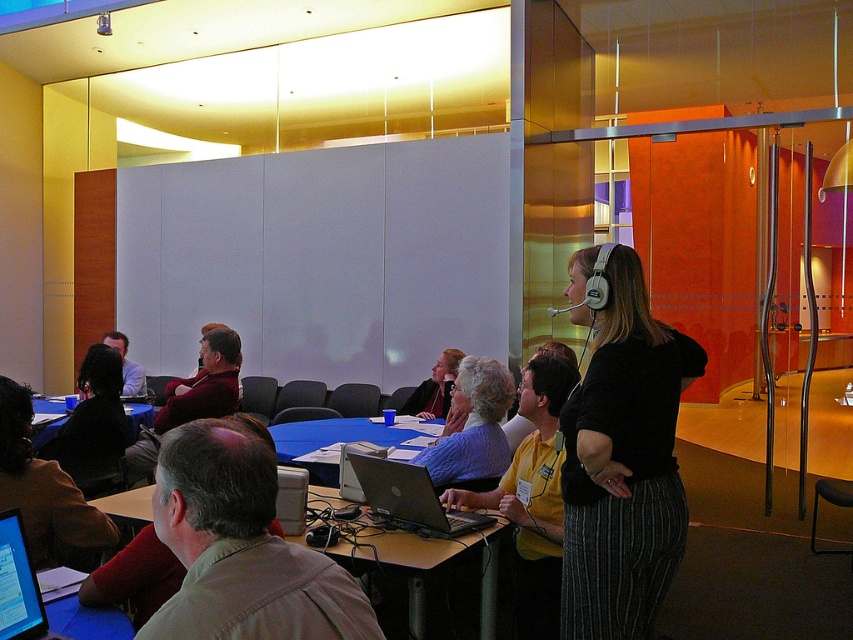
Between blue fabric table at center and matte black laptop at left, which one appears on the left side from the viewer's perspective?

matte black laptop at left

Does blue fabric table at center come behind matte black laptop at left?

That is False.

Where is `blue fabric table at center`? blue fabric table at center is located at coordinates (329, 442).

Where is `blue fabric table at center`? This screenshot has height=640, width=853. blue fabric table at center is located at coordinates (329, 442).

Is point (88, 536) closer to viewer compared to point (146, 413)?

Yes.

In the scene shown: Is dark brown leather jacket at lower left shorter than blue plastic table at center?

In fact, dark brown leather jacket at lower left may be taller than blue plastic table at center.

Does point (15, 392) lie behind point (44, 406)?

No, it is in front of (44, 406).

Find the location of `dark brown leather jacket at lower left`. dark brown leather jacket at lower left is located at coordinates (42, 486).

Between blue fabric shirt at center and matte black laptop at center, which one is positioned lower?

matte black laptop at center

Which of these two, blue fabric shirt at center or matte black laptop at center, stands taller?

Standing taller between the two is blue fabric shirt at center.

At what (x,y) coordinates should I click in order to perform the action: click on blue fabric shirt at center. Please return your answer as a coordinate pair (x, y). The height and width of the screenshot is (640, 853). Looking at the image, I should click on (473, 426).